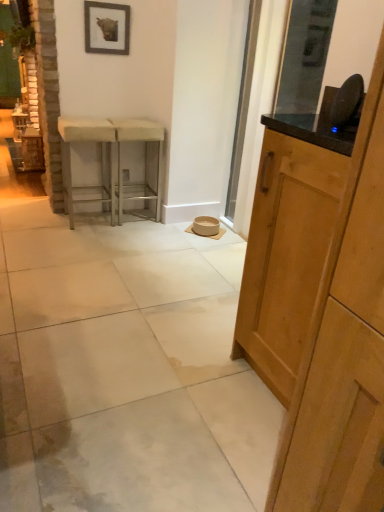
What do you see at coordinates (243, 106) in the screenshot?
I see `transparent glass screen door at center` at bounding box center [243, 106].

Where is `white polished concrete at center`? white polished concrete at center is located at coordinates (130, 366).

Find the location of a particular element. Image resolution: width=384 pixels, height=512 pixels. white fabric stool at left, which is counted as the 2th stool, starting from the right is located at coordinates (101, 158).

Locate an element on the screen. light wood cabinet at right is located at coordinates (286, 255).

Considering the sizes of objects wooden frame at upper center and white polished concrete at center in the image provided, who is wider, wooden frame at upper center or white polished concrete at center?

white polished concrete at center.

Between wooden frame at upper center and white polished concrete at center, which one has larger size?

white polished concrete at center is bigger.

How many degrees apart are the facing directions of wooden frame at upper center and white polished concrete at center?

wooden frame at upper center and white polished concrete at center are facing 2.58 degrees away from each other.

Is metallic silver stool at center, marked as the 1th stool in a right-to-left arrangement, oriented towards light wood cabinet at right?

Yes, metallic silver stool at center, marked as the 1th stool in a right-to-left arrangement, is facing light wood cabinet at right.

Where is `the 1st stool to the left when counting from the light wood cabinet at right`? This screenshot has width=384, height=512. the 1st stool to the left when counting from the light wood cabinet at right is located at coordinates (145, 154).

Is metallic silver stool at center, marked as the 1th stool in a right-to-left arrangement, inside the boundaries of light wood cabinet at right, or outside?

metallic silver stool at center, marked as the 1th stool in a right-to-left arrangement, lies outside light wood cabinet at right.

Is metallic silver stool at center, marked as the 1th stool in a right-to-left arrangement, smaller than light wood cabinet at right?

Indeed, metallic silver stool at center, marked as the 1th stool in a right-to-left arrangement, has a smaller size compared to light wood cabinet at right.

Which object is thinner, white polished concrete at center or light wood cabinet at right?

With smaller width is light wood cabinet at right.

Considering the relative positions of white polished concrete at center and light wood cabinet at right in the image provided, is white polished concrete at center to the left of light wood cabinet at right from the viewer's perspective?

Yes.

In the scene shown: Considering the relative sizes of white polished concrete at center and light wood cabinet at right in the image provided, is white polished concrete at center shorter than light wood cabinet at right?

Yes, white polished concrete at center is shorter than light wood cabinet at right.

Looking at this image, is white polished concrete at center looking in the opposite direction of light wood cabinet at right?

No, white polished concrete at center is not facing away from light wood cabinet at right.

Could you tell me if wooden frame at upper center is facing light wood cabinet at right?

Yes, wooden frame at upper center is aimed at light wood cabinet at right.

Considering their positions, is wooden frame at upper center located in front of or behind light wood cabinet at right?

wooden frame at upper center is behind light wood cabinet at right.

Is wooden frame at upper center not inside light wood cabinet at right?

Yes, wooden frame at upper center is located beyond the bounds of light wood cabinet at right.

Which is in front, point (103, 13) or point (296, 355)?

The point (296, 355) is closer.

Based on their positions, is wooden frame at upper center located to the left or right of white fabric stool at left, the 1th stool when ordered from left to right?

From the image, it's evident that wooden frame at upper center is to the right of white fabric stool at left, the 1th stool when ordered from left to right.

Does wooden frame at upper center come behind white fabric stool at left, the 1th stool when ordered from left to right?

Yes, wooden frame at upper center is behind white fabric stool at left, the 1th stool when ordered from left to right.

Would you say wooden frame at upper center is inside or outside white fabric stool at left, which is counted as the 2th stool, starting from the right?

wooden frame at upper center is not enclosed by white fabric stool at left, which is counted as the 2th stool, starting from the right.

Based on the photo, is white fabric stool at left, which is counted as the 2th stool, starting from the right, at the back of wooden frame at upper center?

No.

Could you tell me if white fabric stool at left, which is counted as the 2th stool, starting from the right, is facing transparent glass screen door at center?

No.

Locate an element on the screen. The width and height of the screenshot is (384, 512). screen door that is above the white fabric stool at left, the 1th stool when ordered from left to right (from a real-world perspective) is located at coordinates (243, 106).

Which of these two, white fabric stool at left, the 1th stool when ordered from left to right, or transparent glass screen door at center, is smaller?

With smaller size is transparent glass screen door at center.

Is white fabric stool at left, which is counted as the 2th stool, starting from the right, wider than transparent glass screen door at center?

Yes.

Between white polished concrete at center and wooden frame at upper center, which one has larger width?

white polished concrete at center is wider.

From a real-world perspective, between white polished concrete at center and wooden frame at upper center, who is vertically higher?

wooden frame at upper center, from a real-world perspective.

Does point (55, 453) lie behind point (100, 41)?

No, it is in front of (100, 41).

Find the location of a particular element. The width and height of the screenshot is (384, 512). concrete on the left of wooden frame at upper center is located at coordinates (130, 366).

You are a GUI agent. You are given a task and a screenshot of the screen. Output one action in this format:
    pyautogui.click(x=<x>, y=<y>)
    Task: Click on the cabinetry above the metallic silver stool at center, marked as the 2th stool in a left-to-right arrangement (from a real-world perspective)
    This screenshot has width=384, height=512.
    Given the screenshot: What is the action you would take?
    pyautogui.click(x=286, y=255)

From the image, which object appears to be nearer to metallic silver stool at center, marked as the 1th stool in a right-to-left arrangement, transparent glass screen door at center or wooden frame at upper center?

wooden frame at upper center.

Based on the photo, estimate the real-world distances between objects in this image. Which object is further from light wood cabinet at right, metallic silver stool at center, marked as the 1th stool in a right-to-left arrangement, or transparent glass screen door at center?

Based on the image, transparent glass screen door at center appears to be further to light wood cabinet at right.

Estimate the real-world distances between objects in this image. Which object is further from white polished concrete at center, white fabric stool at left, which is counted as the 2th stool, starting from the right, or wooden frame at upper center?

wooden frame at upper center lies further to white polished concrete at center than the other object.

Which object lies nearer to the anchor point wooden frame at upper center, white fabric stool at left, which is counted as the 2th stool, starting from the right, or light wood cabinet at right?

white fabric stool at left, which is counted as the 2th stool, starting from the right, is closer to wooden frame at upper center.

Looking at the image, which one is located further to transparent glass screen door at center, light wood cabinet at right or white fabric stool at left, which is counted as the 2th stool, starting from the right?

Based on the image, light wood cabinet at right appears to be further to transparent glass screen door at center.

From the image, which object appears to be nearer to light wood cabinet at right, white fabric stool at left, the 1th stool when ordered from left to right, or transparent glass screen door at center?

The object closer to light wood cabinet at right is transparent glass screen door at center.

When comparing their distances from transparent glass screen door at center, does wooden frame at upper center or metallic silver stool at center, marked as the 1th stool in a right-to-left arrangement, seem further?

wooden frame at upper center is positioned further to the anchor transparent glass screen door at center.

Estimate the real-world distances between objects in this image. Which object is closer to transparent glass screen door at center, white fabric stool at left, which is counted as the 2th stool, starting from the right, or wooden frame at upper center?

Among the two, wooden frame at upper center is located nearer to transparent glass screen door at center.

The width and height of the screenshot is (384, 512). What are the coordinates of `screen door between light wood cabinet at right and white fabric stool at left, the 1th stool when ordered from left to right, in the front-back direction` in the screenshot? It's located at point(243,106).

You are a GUI agent. You are given a task and a screenshot of the screen. Output one action in this format:
    pyautogui.click(x=<x>, y=<y>)
    Task: Click on the screen door located between light wood cabinet at right and wooden frame at upper center in the depth direction
    
    Given the screenshot: What is the action you would take?
    pyautogui.click(x=243, y=106)

Where is `stool between wooden frame at upper center and transparent glass screen door at center`? stool between wooden frame at upper center and transparent glass screen door at center is located at coordinates (145, 154).

At what (x,y) coordinates should I click in order to perform the action: click on screen door between white polished concrete at center and white fabric stool at left, the 1th stool when ordered from left to right, in the front-back direction. Please return your answer as a coordinate pair (x, y). The width and height of the screenshot is (384, 512). Looking at the image, I should click on (243, 106).